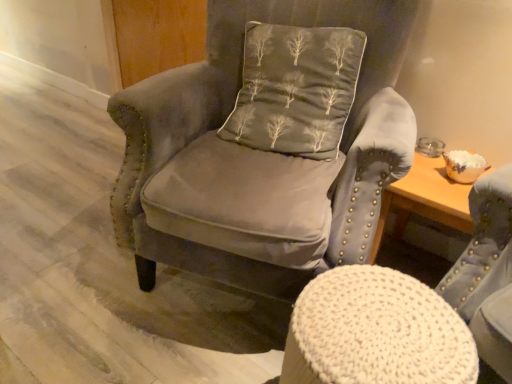
The width and height of the screenshot is (512, 384). What are the coordinates of `vacant area on top of knitted fabric stool at center, which ranks as the 2th chair in top-to-bottom order (from a real-world perspective)` in the screenshot? It's located at (382, 325).